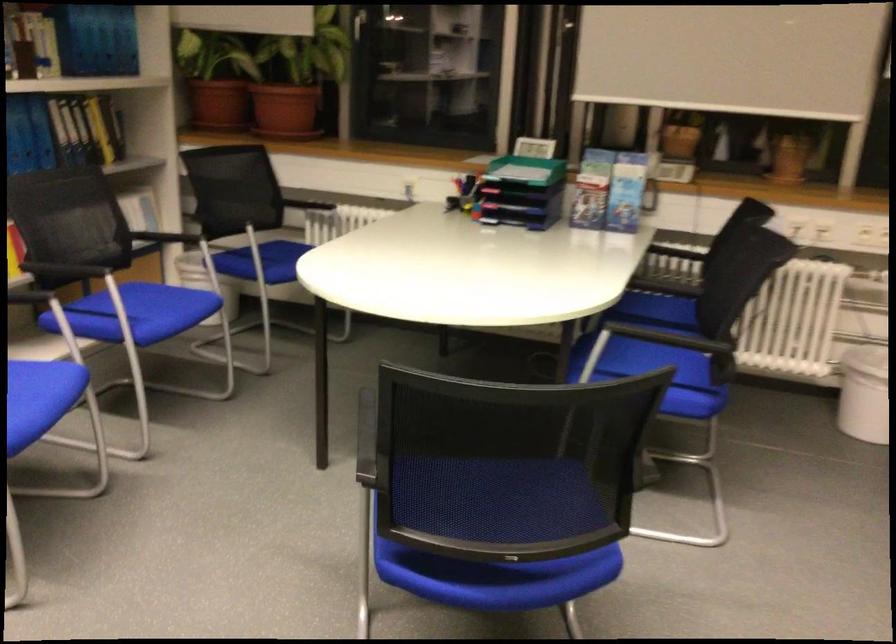
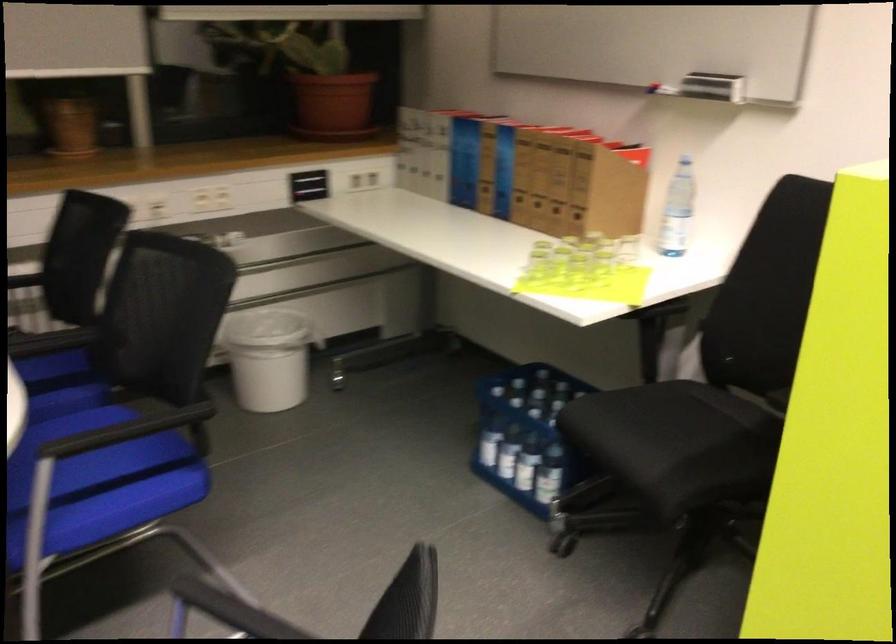
Question: The images are taken continuously from a first-person perspective. In which direction is your viewpoint rotating?

Choices:
 (A) Left
 (B) Right
 (C) Up
 (D) Down

Answer: (B)